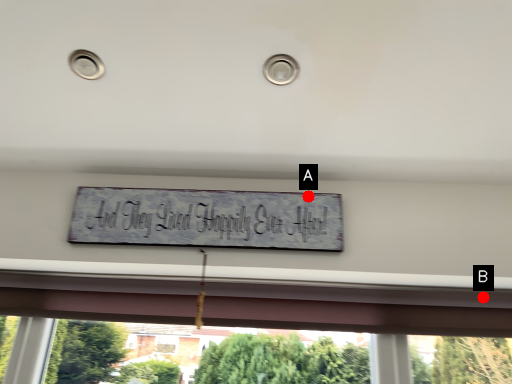
Question: Two points are circled on the image, labeled by A and B beside each circle. Which of the following is the farthest from the observer?

Choices:
 (A) A is further
 (B) B is further

Answer: (B)